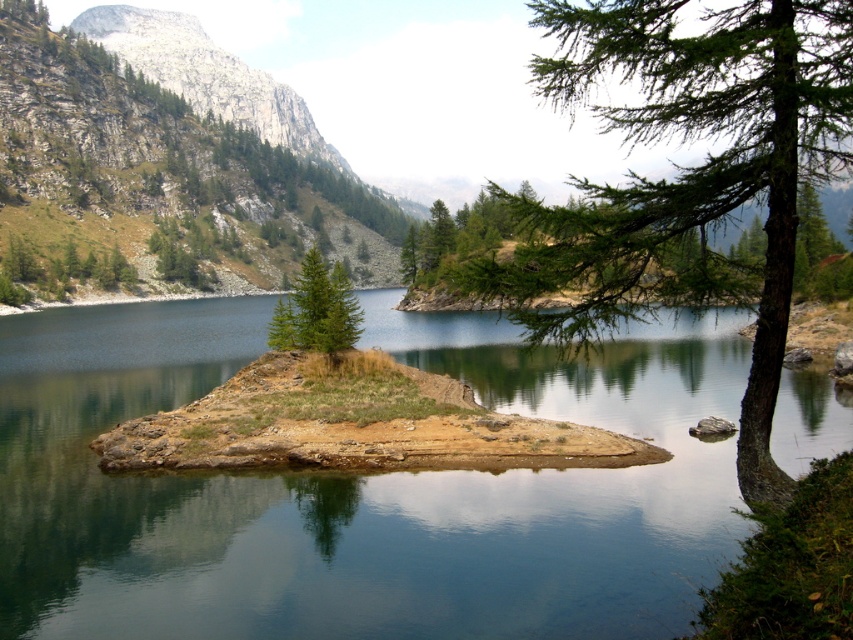
Can you confirm if green grassy island at center is smaller than green needle-like tree at right?

Correct, green grassy island at center occupies less space than green needle-like tree at right.

At what (x,y) coordinates should I click in order to perform the action: click on green grassy island at center. Please return your answer as a coordinate pair (x, y). Looking at the image, I should click on (360, 486).

Locate an element on the screen. green grassy island at center is located at coordinates (360, 486).

Does point (541, 400) come in front of point (299, 285)?

That is True.

Image resolution: width=853 pixels, height=640 pixels. What do you see at coordinates (360, 486) in the screenshot? I see `green grassy island at center` at bounding box center [360, 486].

The height and width of the screenshot is (640, 853). In order to click on green grassy island at center in this screenshot , I will do tap(360, 486).

Is point (753, 145) less distant than point (279, 330)?

Yes, it is.

Is green needle-like tree at right shorter than green needle-like tree at center?

Incorrect, green needle-like tree at right's height does not fall short of green needle-like tree at center's.

What do you see at coordinates (689, 173) in the screenshot? This screenshot has width=853, height=640. I see `green needle-like tree at right` at bounding box center [689, 173].

Where is `green needle-like tree at right`? green needle-like tree at right is located at coordinates (689, 173).